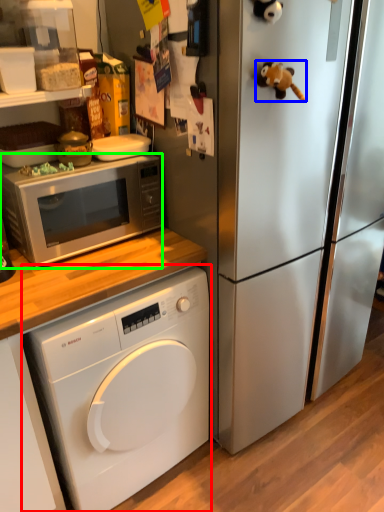
Question: Which object is the closest to the washing machine (highlighted by a red box)? Choose among these: toy (highlighted by a blue box) or microwave oven (highlighted by a green box).

Choices:
 (A) toy
 (B) microwave oven

Answer: (B)